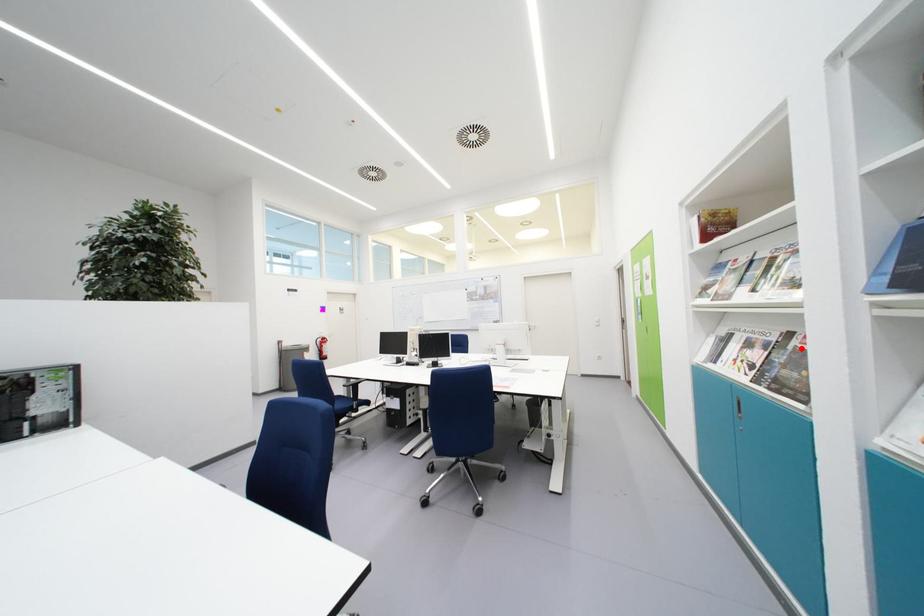
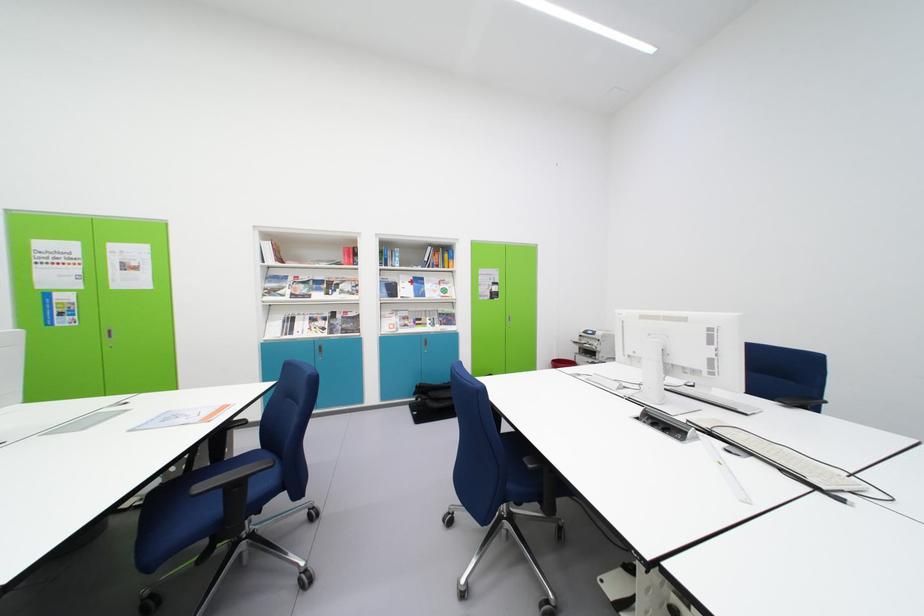
Find the pixel in the second image that matches the highlighted location in the first image.

(345, 320)